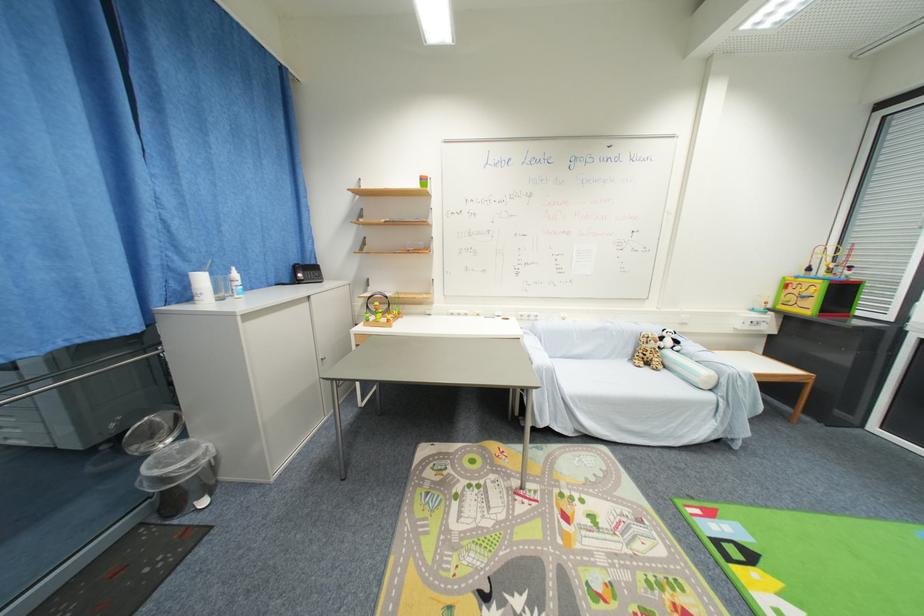
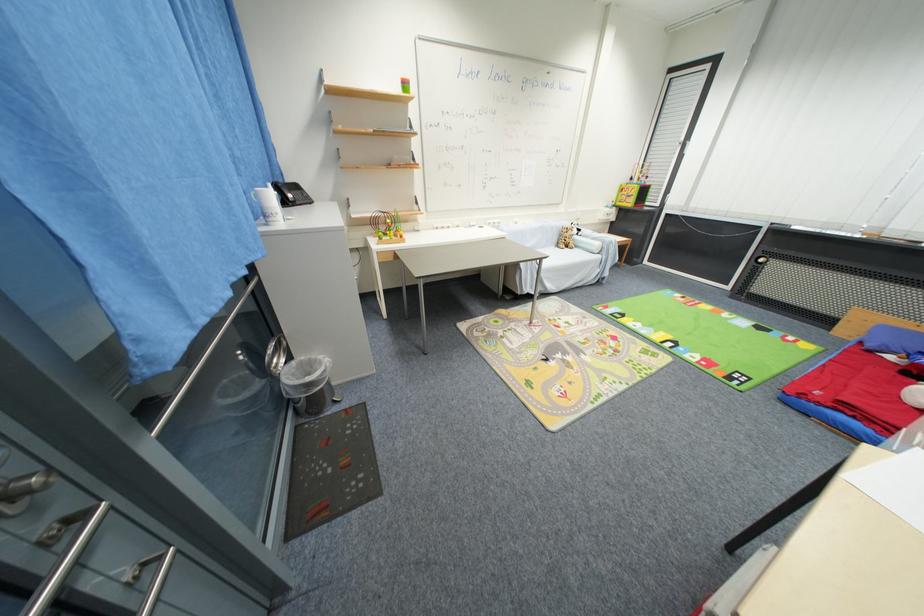
Locate, in the second image, the point that corresponds to (201,301) in the first image.

(275, 222)